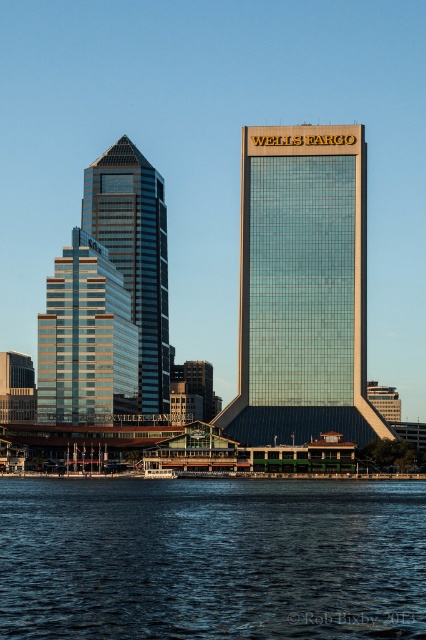
You are standing at point (152, 616) and want to walk to the nearest skyscraper. Which one should you head towards?

The point (152, 616) is closer to the modern triangular building on the left than the taller rectangular Wells Fargo building on the right, so you should head towards the modern triangular building on the left.

You are a photographer standing at the waterfront and want to capture both the shiny glass skyscraper at center and the matte glass skyscraper at center in a single shot. Which skyscraper should you focus on first to ensure both are in frame?

You should focus on the shiny glass skyscraper at center first because it is located above the matte glass skyscraper at center, so adjusting the camera angle to include the upper structure will naturally include the lower one as well.

You are a tourist standing on the waterfront and want to take a photo of both shiny glass skyscraper at center and shiny glass skyscraper at left. Based on their positions, which skyscraper should you position to your left side to include both in the frame?

You should position the shiny glass skyscraper at left to your left side because it is to the left of the shiny glass skyscraper at center.